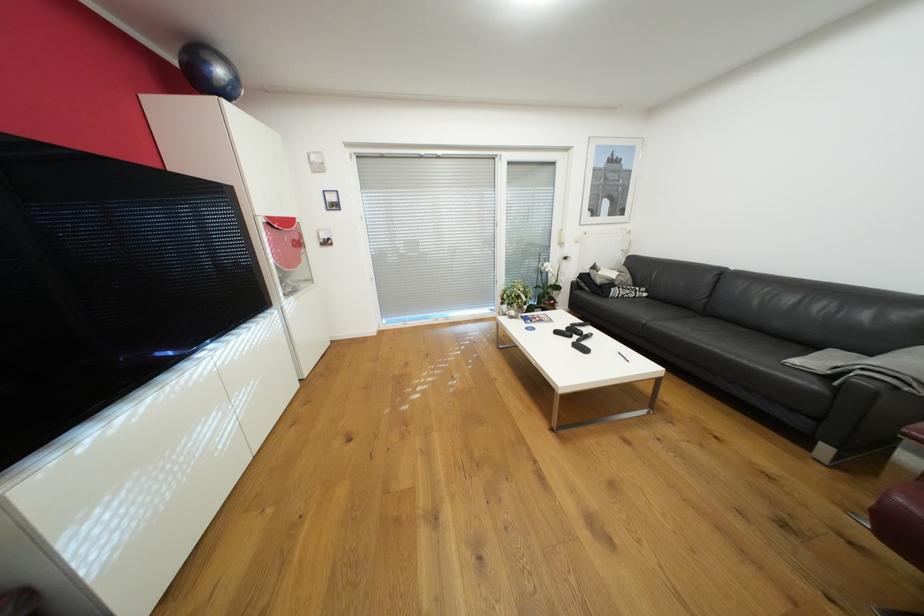
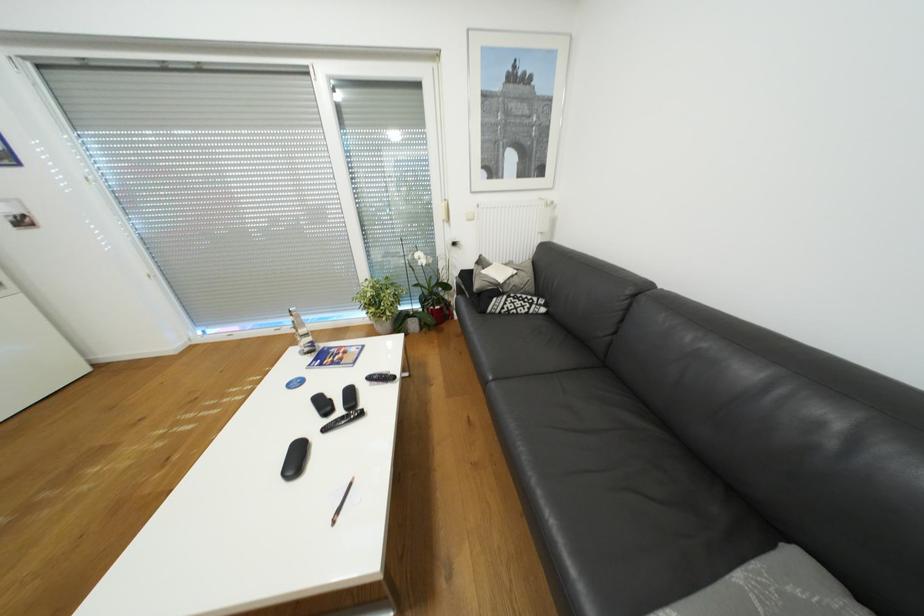
What movement of the cameraman would produce the second image?

The cameraman moved toward right, forward.